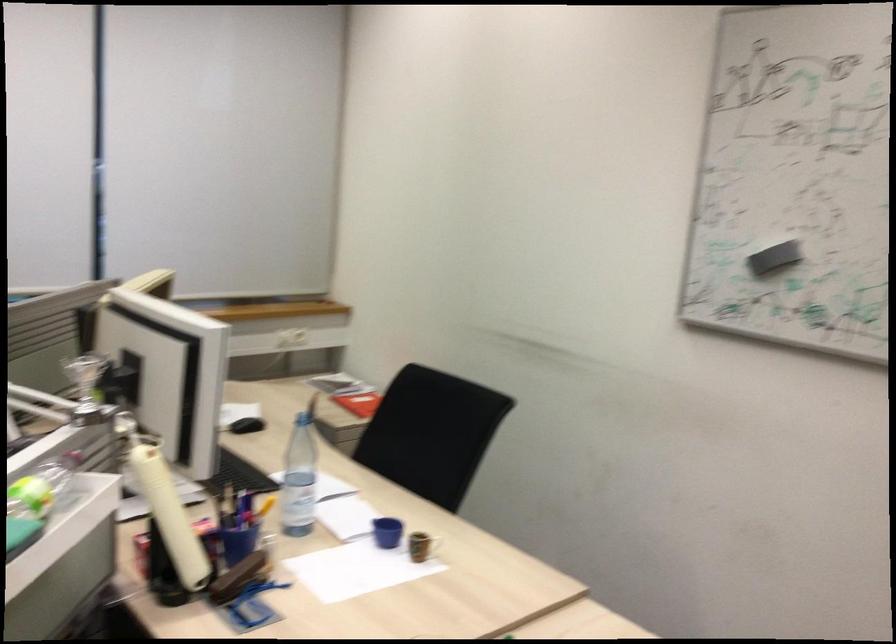
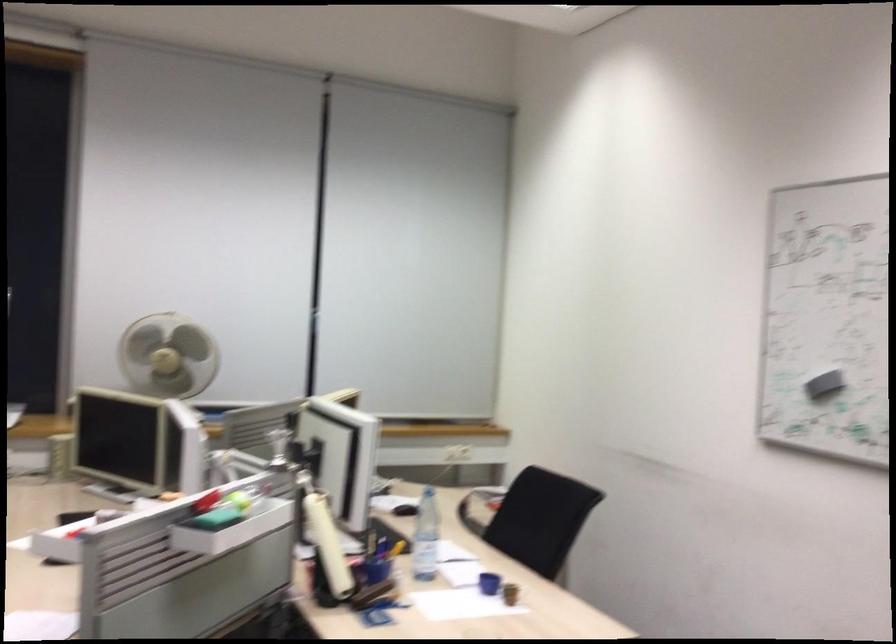
In the second image, find the point that corresponds to point (251, 522) in the first image.

(377, 563)